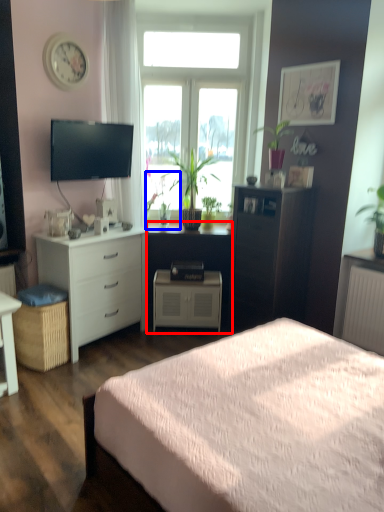
Question: Among these objects, which one is farthest to the camera, computer desk (highlighted by a red box) or houseplant (highlighted by a blue box)?

Choices:
 (A) computer desk
 (B) houseplant

Answer: (A)